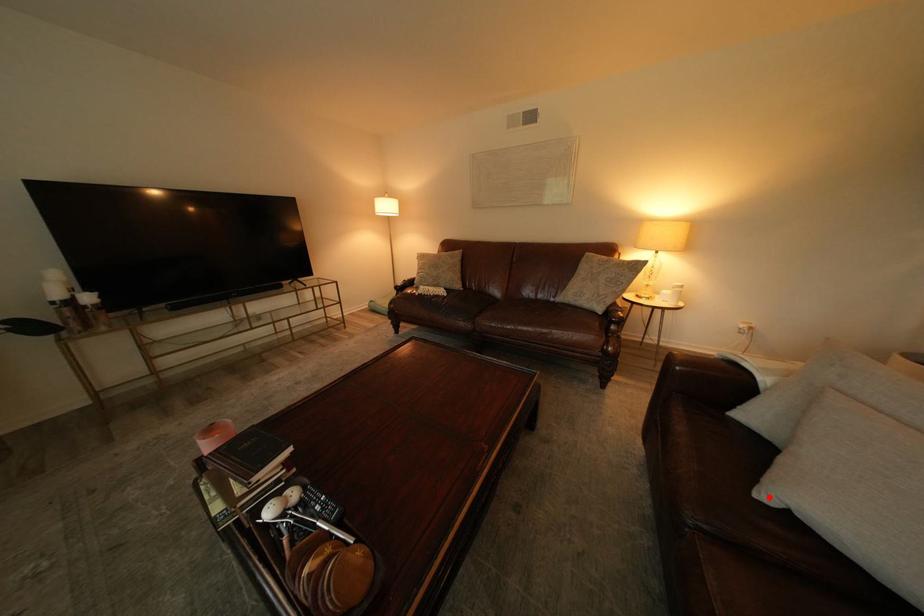
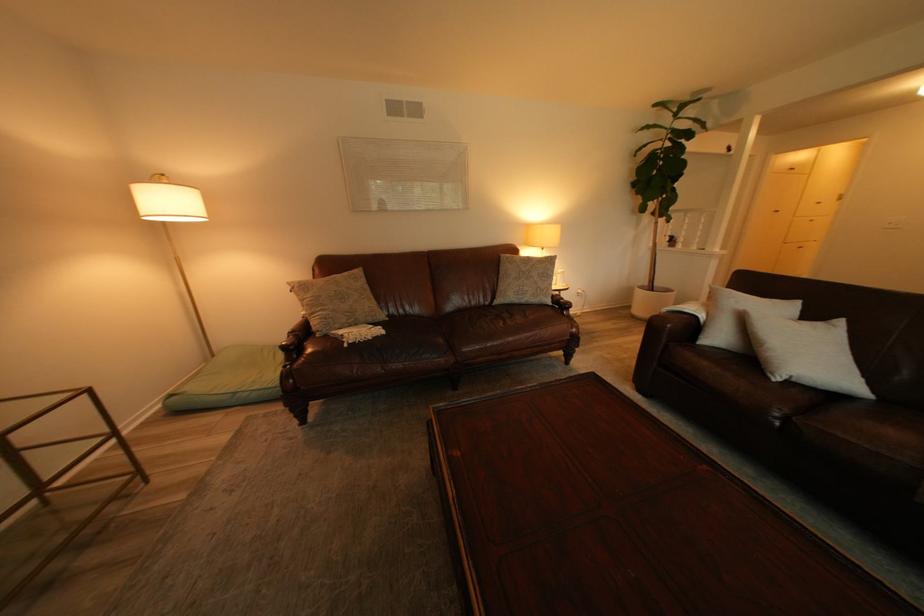
In the second image, find the point that corresponds to the highlighted location in the first image.

(787, 381)